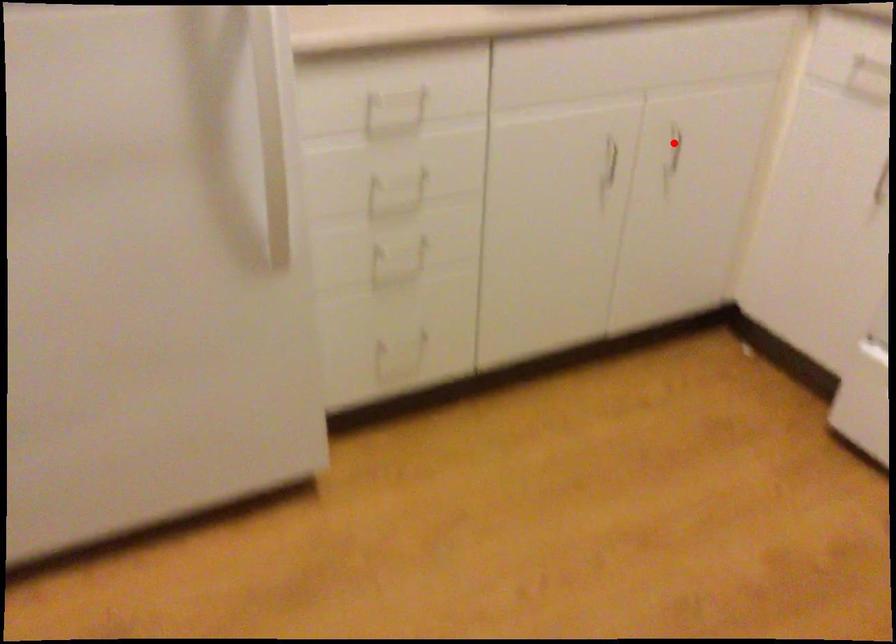
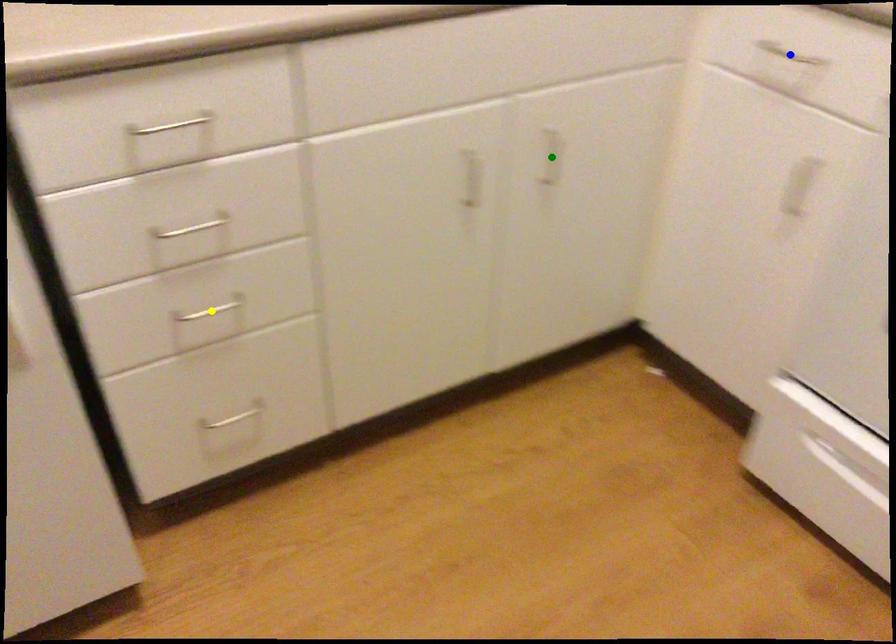
Question: I am providing you with two images of the same scene from different viewpoints. A red point is marked on the first image. You are given multiple points on the second image. Which point in image 2 represents the same 3d spot as the red point in image 1?

Choices:
 (A) yellow point
 (B) blue point
 (C) green point

Answer: (C)